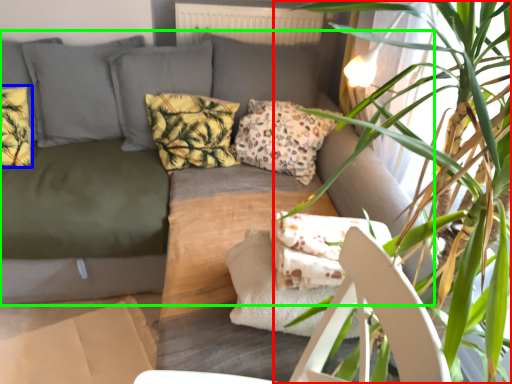
Question: Which object is positioned closest to houseplant (highlighted by a red box)? Select from pillow (highlighted by a blue box) and studio couch (highlighted by a green box).

Choices:
 (A) pillow
 (B) studio couch

Answer: (B)